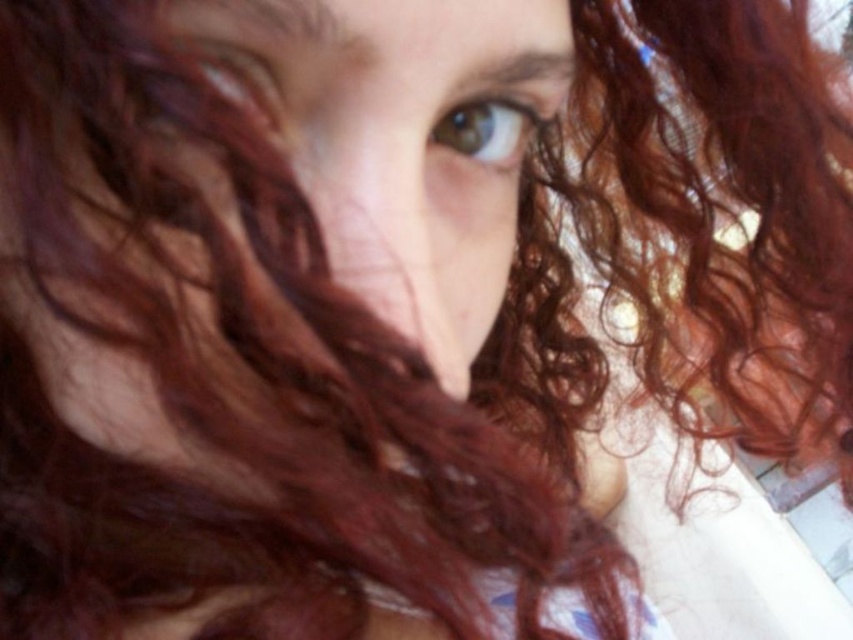
Does curly hair at center appear over brown matte eye at upper center?

Actually, curly hair at center is below brown matte eye at upper center.

Is curly hair at center bigger than brown matte eye at upper center?

Yes, curly hair at center is bigger than brown matte eye at upper center.

The width and height of the screenshot is (853, 640). I want to click on curly hair at center, so click(x=399, y=138).

You are a GUI agent. You are given a task and a screenshot of the screen. Output one action in this format:
    pyautogui.click(x=<x>, y=<y>)
    Task: Click on the curly hair at center
    
    Given the screenshot: What is the action you would take?
    pyautogui.click(x=399, y=138)